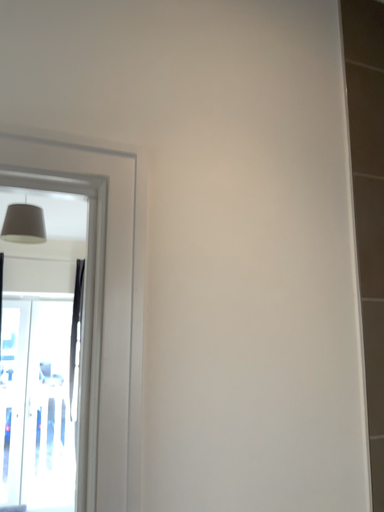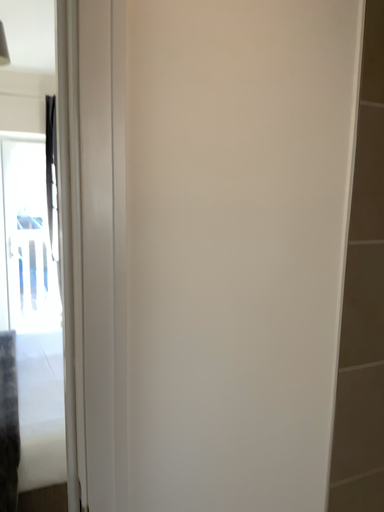
Question: How did the camera likely rotate when shooting the video?

Choices:
 (A) rotated downward
 (B) rotated upward

Answer: (A)